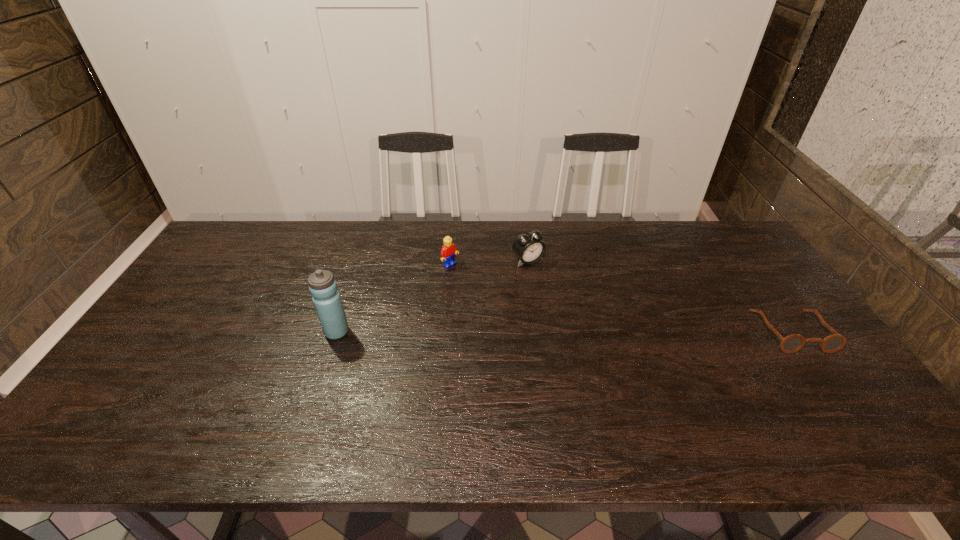
In order to click on free space on the desktop that is between the tallest object and the rightmost object and is positioned on the front-facing side of the second object from left to right in this screenshot , I will do `click(534, 332)`.

Where is `vacant spot on the desktop that is between the tallest object and the shortest object and is positioned on the front side of the second object from right to left`? vacant spot on the desktop that is between the tallest object and the shortest object and is positioned on the front side of the second object from right to left is located at coordinates (599, 332).